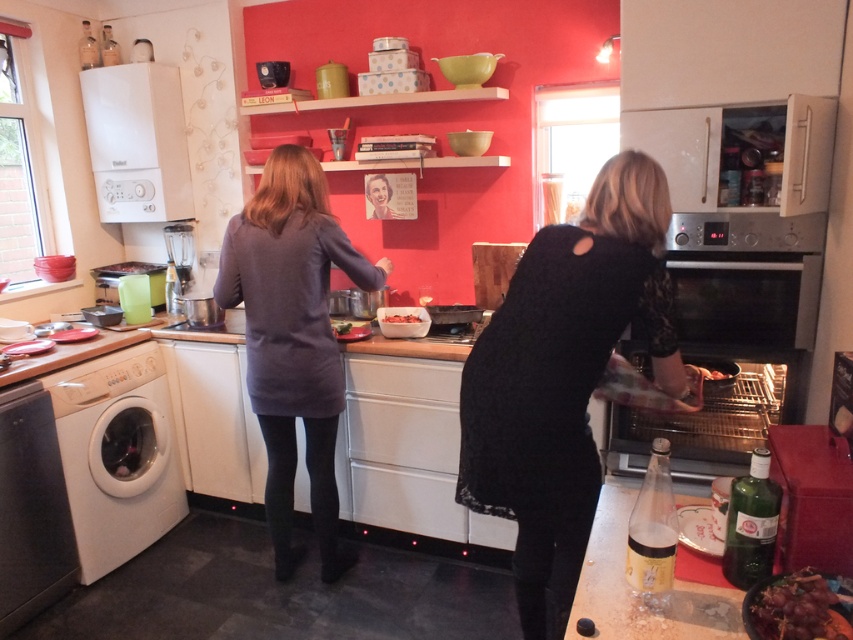
Is shiny purple grapes at lower right positioned in front of smooth plastic portrait at center?

Yes, shiny purple grapes at lower right is in front of smooth plastic portrait at center.

Does shiny purple grapes at lower right have a lesser width compared to smooth plastic portrait at center?

In fact, shiny purple grapes at lower right might be wider than smooth plastic portrait at center.

You are a GUI agent. You are given a task and a screenshot of the screen. Output one action in this format:
    pyautogui.click(x=<x>, y=<y>)
    Task: Click on the shiny purple grapes at lower right
    This screenshot has height=640, width=853.
    Given the screenshot: What is the action you would take?
    pyautogui.click(x=791, y=608)

This screenshot has height=640, width=853. What do you see at coordinates (380, 196) in the screenshot? I see `smooth plastic portrait at center` at bounding box center [380, 196].

Based on the photo, who is positioned more to the right, smooth plastic portrait at center or smooth white cheese at center?

Positioned to the right is smooth white cheese at center.

Does point (364, 186) lie in front of point (413, 317)?

That is False.

Locate an element on the screen. The image size is (853, 640). smooth plastic portrait at center is located at coordinates (380, 196).

Is shiny purple grapes at lower right to the left of smooth white cheese at center from the viewer's perspective?

In fact, shiny purple grapes at lower right is to the right of smooth white cheese at center.

Is shiny purple grapes at lower right wider than smooth white cheese at center?

In fact, shiny purple grapes at lower right might be narrower than smooth white cheese at center.

Is point (820, 602) closer to viewer compared to point (393, 316)?

Yes, point (820, 602) is in front of point (393, 316).

Find the location of a particular element. This screenshot has height=640, width=853. shiny purple grapes at lower right is located at coordinates (791, 608).